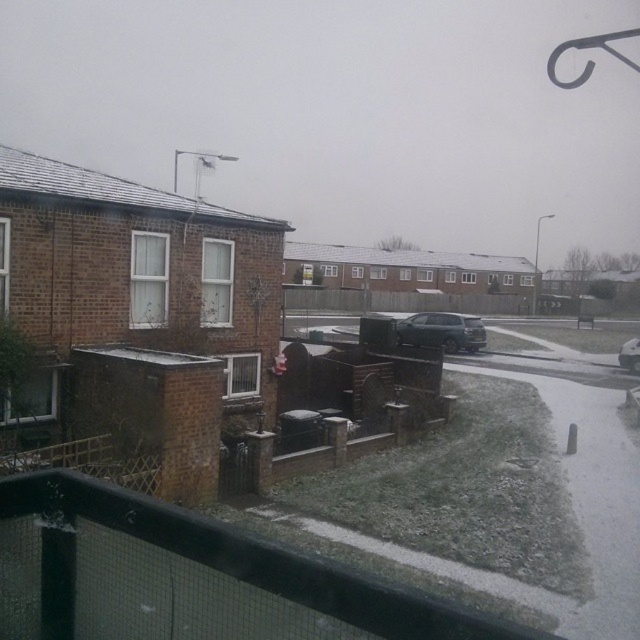
Does satin black car at center have a lesser height compared to white glossy car at center?

Incorrect, satin black car at center's height does not fall short of white glossy car at center's.

Image resolution: width=640 pixels, height=640 pixels. What are the coordinates of `satin black car at center` in the screenshot? It's located at (442, 330).